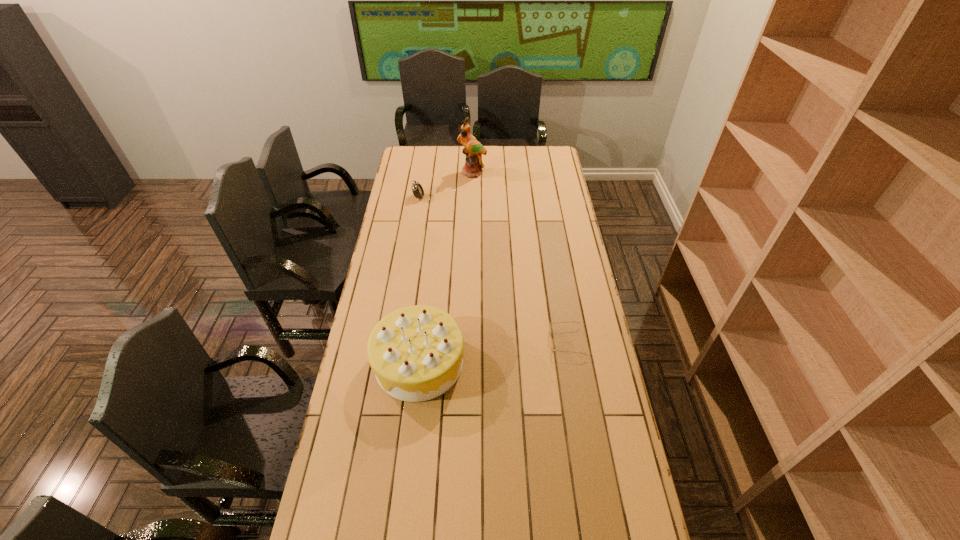
I want to click on free space between the spectacles and the birthday cake, so click(x=492, y=352).

I want to click on vacant space that is in between the spectacles and the third shortest object, so click(x=492, y=352).

Where is `vacant region between the shortest object and the second tallest object`? This screenshot has height=540, width=960. vacant region between the shortest object and the second tallest object is located at coordinates (492, 352).

What are the coordinates of `vacant space that is in between the parrot and the second tallest object` in the screenshot? It's located at pyautogui.click(x=445, y=268).

Where is `free spot between the rightmost object and the birthday cake`? This screenshot has height=540, width=960. free spot between the rightmost object and the birthday cake is located at coordinates (492, 352).

The width and height of the screenshot is (960, 540). I want to click on free space between the spectacles and the third tallest object, so click(x=492, y=269).

At what (x,y) coordinates should I click in order to perform the action: click on free space that is in between the parrot and the spectacles. Please return your answer as a coordinate pair (x, y). Image resolution: width=960 pixels, height=540 pixels. Looking at the image, I should click on (519, 257).

At what (x,y) coordinates should I click in order to perform the action: click on object identified as the closest to the tallest object. Please return your answer as a coordinate pair (x, y). Looking at the image, I should click on [x=417, y=189].

Identify which object is the closest to the second shortest object. Please provide its 2D coordinates. Your answer should be formatted as a tuple, i.e. [(x, y)], where the tuple contains the x and y coordinates of a point satisfying the conditions above.

[(473, 149)]